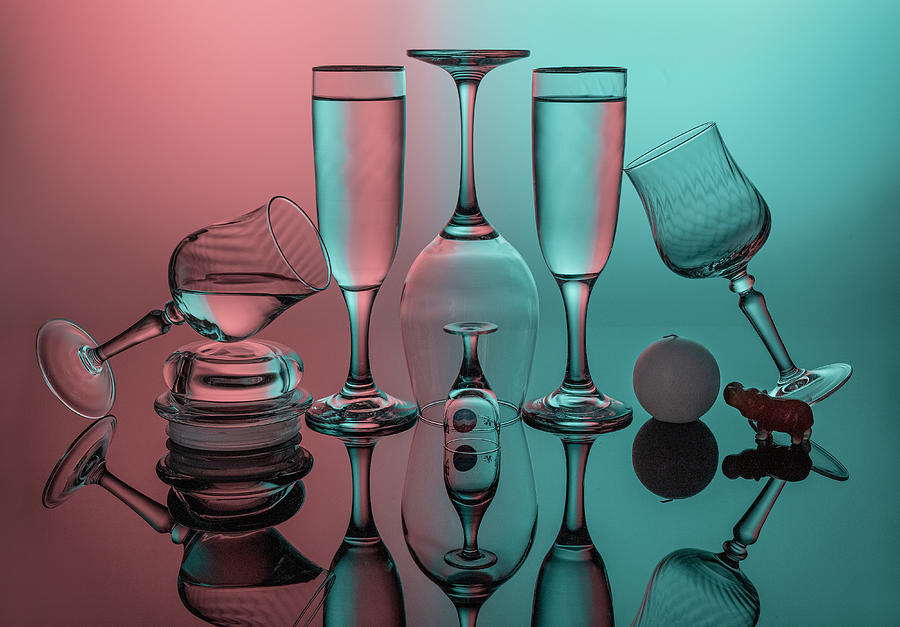
You are a GUI agent. You are given a task and a screenshot of the screen. Output one action in this format:
    pyautogui.click(x=<x>, y=<y>)
    Task: Click on the candle
    The height and width of the screenshot is (627, 900).
    Given the screenshot: What is the action you would take?
    pyautogui.click(x=685, y=359)